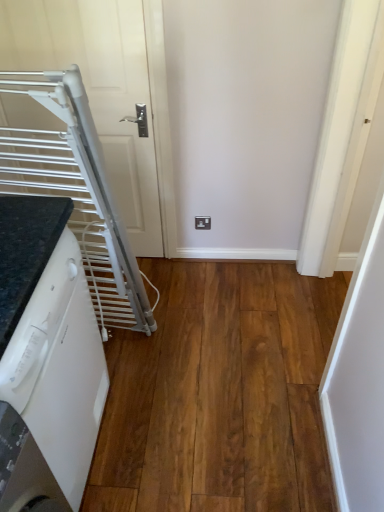
Question: Considering their positions, is white glossy dishwasher at lower left located in front of or behind brown wood flooring at lower left?

Choices:
 (A) front
 (B) behind

Answer: (A)

Question: Is white glossy dishwasher at lower left to the left or to the right of brown wood flooring at lower left in the image?

Choices:
 (A) right
 (B) left

Answer: (B)

Question: Estimate the real-world distances between objects in this image. Which object is farther from the white matte door at upper left?

Choices:
 (A) brown wood flooring at lower left
 (B) white glossy dishwasher at lower left

Answer: (B)

Question: Which object is the farthest from the white matte door at upper left?

Choices:
 (A) brown wood flooring at lower left
 (B) white glossy dishwasher at lower left

Answer: (B)